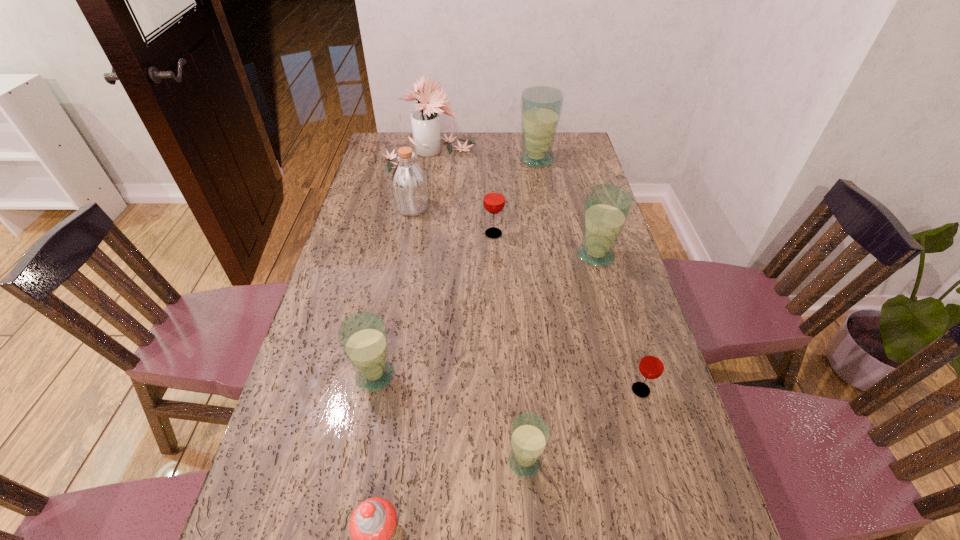
Find the location of a particular element. Image resolution: width=960 pixels, height=540 pixels. vacant space located 0.190m on the front of the smaller red glass is located at coordinates (668, 484).

Locate an element on the screen. The height and width of the screenshot is (540, 960). blank space located 0.220m on the back of the smallest blue glass is located at coordinates (517, 359).

This screenshot has width=960, height=540. What are the coordinates of `bouquet that is at the far edge` in the screenshot? It's located at (425, 122).

Where is `glass that is positioned at the far edge`? glass that is positioned at the far edge is located at coordinates tap(541, 106).

This screenshot has width=960, height=540. In order to click on bouquet present at the left edge in this screenshot , I will do `click(425, 122)`.

You are a GUI agent. You are given a task and a screenshot of the screen. Output one action in this format:
    pyautogui.click(x=<x>, y=<y>)
    Task: Click on the bottle that is at the left edge
    
    Given the screenshot: What is the action you would take?
    pyautogui.click(x=409, y=185)

Image resolution: width=960 pixels, height=540 pixels. What are the coordinates of `glass that is at the left edge` in the screenshot? It's located at (363, 337).

The height and width of the screenshot is (540, 960). I want to click on object that is at the far left corner, so click(425, 122).

At what (x,y) coordinates should I click in order to perform the action: click on object located in the far right corner section of the desktop. Please return your answer as a coordinate pair (x, y). Looking at the image, I should click on (541, 106).

What are the coordinates of `free space at the left edge of the desktop` in the screenshot? It's located at (366, 210).